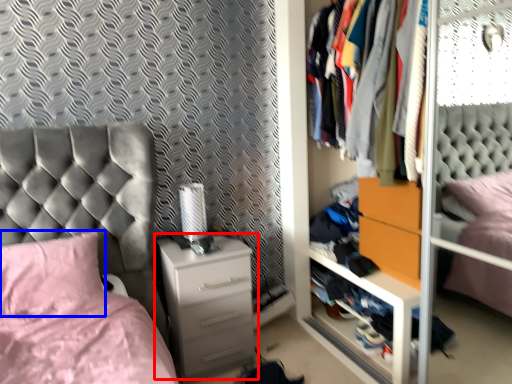
Question: Which object appears closest to the camera in this image, chest of drawers (highlighted by a red box) or pillow (highlighted by a blue box)?

Choices:
 (A) chest of drawers
 (B) pillow

Answer: (B)